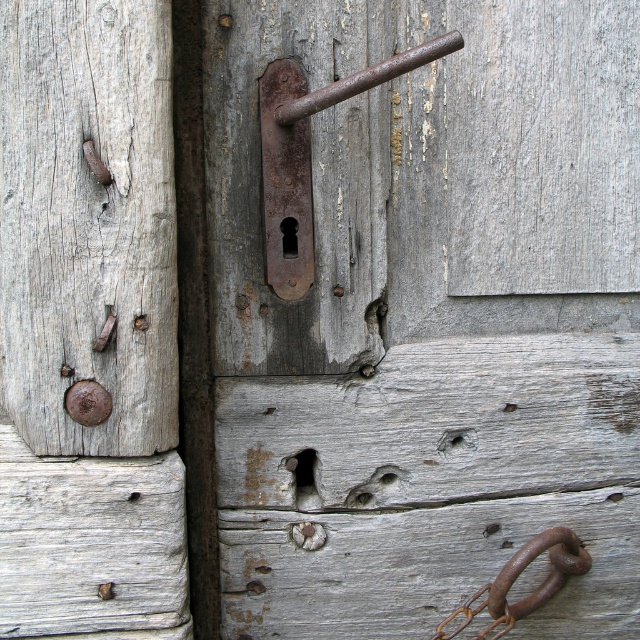
What do you see at coordinates (428, 316) in the screenshot?
I see `rusty metal handle at center` at bounding box center [428, 316].

Does point (621, 170) come behind point (321, 100)?

Yes, point (621, 170) is farther from viewer.

Which is behind, point (438, 22) or point (333, 96)?

Positioned behind is point (438, 22).

Image resolution: width=640 pixels, height=640 pixels. What are the coordinates of `rusty metal handle at center` in the screenshot? It's located at (428, 316).

Is point (72, 88) positioned after point (500, 609)?

No, (72, 88) is closer to viewer.

Who is positioned more to the right, gray wood door at center or rusty metal hook at lower right?

Positioned to the right is rusty metal hook at lower right.

Is point (86, 598) behind point (492, 586)?

No, it is not.

At what (x,y) coordinates should I click in order to perform the action: click on gray wood door at center. Please return your answer as a coordinate pair (x, y). Looking at the image, I should click on (88, 324).

Which is above, rusty metal handle at center or gray wood door at center?

rusty metal handle at center

The width and height of the screenshot is (640, 640). I want to click on rusty metal handle at center, so (428, 316).